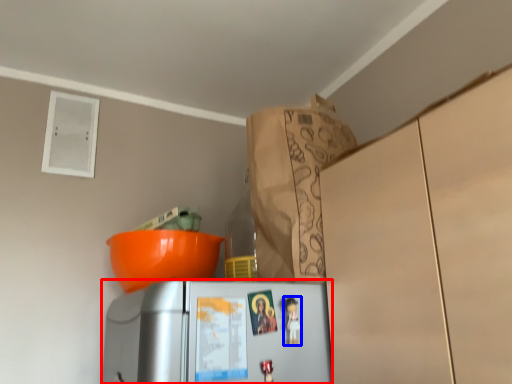
Question: Which object is further to the camera taking this photo, refrigerator (highlighted by a red box) or toy (highlighted by a blue box)?

Choices:
 (A) refrigerator
 (B) toy

Answer: (B)